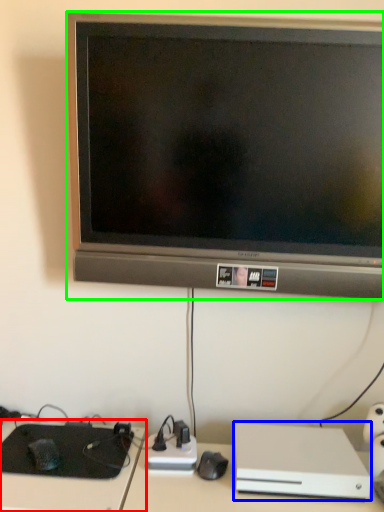
Question: Considering the real-world distances, which object is closest to computer desk (highlighted by a red box)? computer (highlighted by a blue box) or television (highlighted by a green box).

Choices:
 (A) computer
 (B) television

Answer: (A)